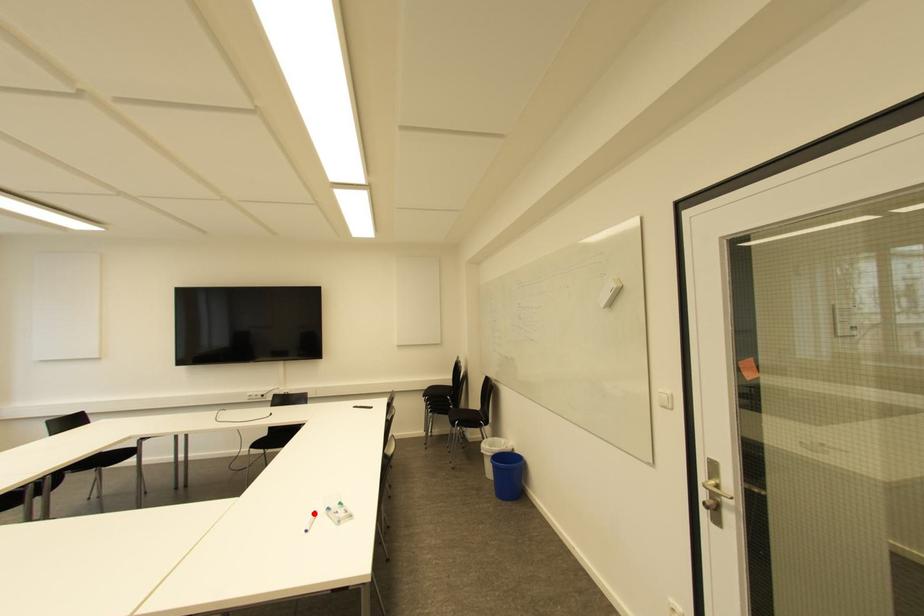
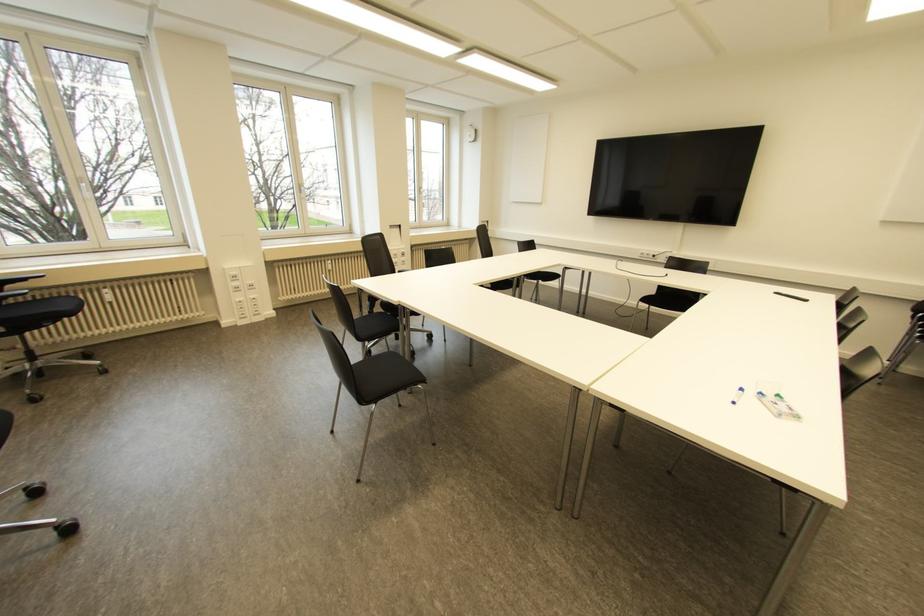
Question: I am providing you with two images of the same scene from different viewpoints. A red point is shown in image1. For the corresponding object point in image2, is it positioned nearer or farther from the camera?

Choices:
 (A) Nearer
 (B) Farther

Answer: (A)